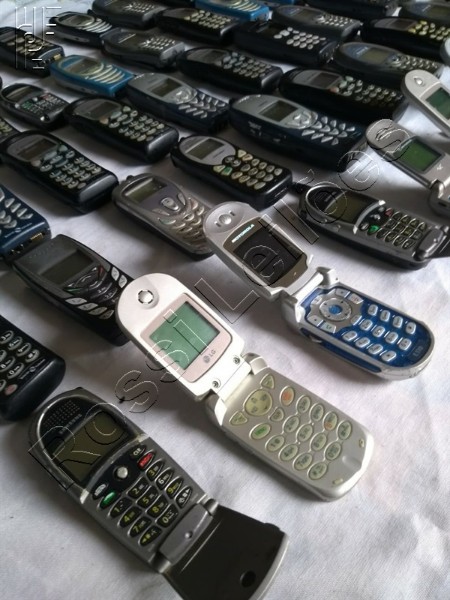
Find the location of a particular element. speaker is located at coordinates (60, 417), (147, 290), (229, 218), (40, 251), (318, 198), (386, 132), (421, 81).